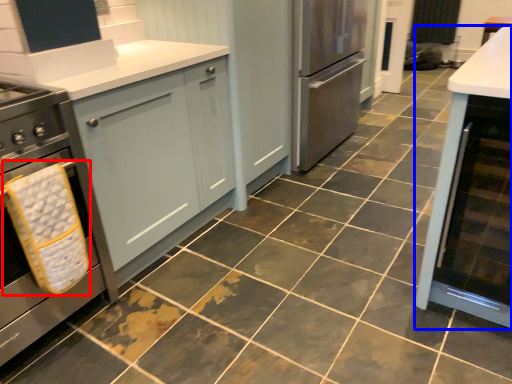
Question: Among these objects, which one is farthest to the camera, material (highlighted by a red box) or cabinetry (highlighted by a blue box)?

Choices:
 (A) material
 (B) cabinetry

Answer: (A)